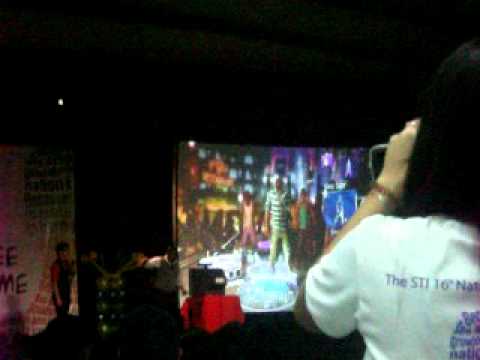
In order to click on red tablecloth in this screenshot , I will do `click(213, 307)`.